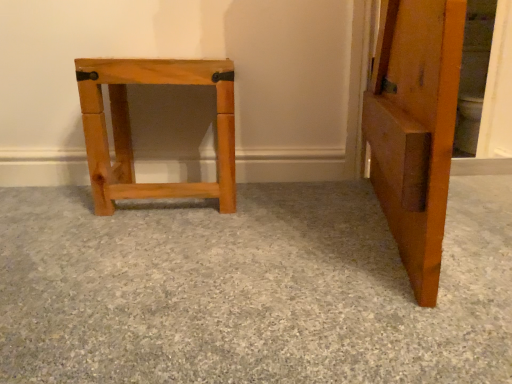
What do you see at coordinates (250, 289) in the screenshot? I see `natural wood stool at left` at bounding box center [250, 289].

The height and width of the screenshot is (384, 512). Find the location of `natural wood stool at left`. natural wood stool at left is located at coordinates (250, 289).

In order to face natural wood stool at left, should I rotate leftwards or rightwards?

You should look right and rotate roughly 3.072 degrees.

In order to click on natural wood stool at center in this screenshot , I will do `click(130, 128)`.

Describe the element at coordinates (130, 128) in the screenshot. I see `natural wood stool at center` at that location.

Identify the location of natural wood stool at left. (250, 289).

Which object is positioned more to the right, natural wood stool at center or natural wood stool at left?

natural wood stool at left.

Looking at this image, considering the positions of objects natural wood stool at center and natural wood stool at left in the image provided, who is in front, natural wood stool at center or natural wood stool at left?

natural wood stool at left is more forward.

Considering the points (116, 179) and (409, 297), which point is in front, point (116, 179) or point (409, 297)?

The point (409, 297) is closer to the camera.

From the image's perspective, is natural wood stool at center above or below natural wood stool at left?

Based on their image positions, natural wood stool at center is located above natural wood stool at left.

From the picture: From a real-world perspective, which object stands above the other?

From a 3D spatial view, natural wood stool at center is above.

Is natural wood stool at center thinner than natural wood stool at left?

Yes, natural wood stool at center is thinner than natural wood stool at left.

Who is taller, natural wood stool at center or natural wood stool at left?

natural wood stool at center.

Which of these two, natural wood stool at center or natural wood stool at left, is smaller?

Smaller between the two is natural wood stool at center.

Choose the correct answer: Is natural wood stool at center inside natural wood stool at left or outside it?

natural wood stool at center is spatially situated outside natural wood stool at left.

Does natural wood stool at center touch natural wood stool at left?

No, natural wood stool at center is not touching natural wood stool at left.

Is natural wood stool at center facing towards natural wood stool at left?

Yes, natural wood stool at center is turned towards natural wood stool at left.

Where is `concrete that is in front of the natural wood stool at center`? The height and width of the screenshot is (384, 512). concrete that is in front of the natural wood stool at center is located at coordinates (250, 289).

Consider the image. Between natural wood stool at left and natural wood stool at center, which one appears on the right side from the viewer's perspective?

natural wood stool at left.

Does natural wood stool at left lie behind natural wood stool at center?

No, natural wood stool at left is in front of natural wood stool at center.

Does point (128, 341) appear closer or farther from the camera than point (95, 113)?

Point (128, 341) is closer to the camera than point (95, 113).

From the image's perspective, is natural wood stool at left above or below natural wood stool at center?

Based on their image positions, natural wood stool at left is located beneath natural wood stool at center.

From a real-world perspective, is natural wood stool at left positioned under natural wood stool at center based on gravity?

Yes.

Looking at this image, can you confirm if natural wood stool at left is thinner than natural wood stool at center?

No.

Based on the photo, considering the sizes of natural wood stool at left and natural wood stool at center in the image, is natural wood stool at left taller or shorter than natural wood stool at center?

natural wood stool at left is shorter than natural wood stool at center.

Between natural wood stool at left and natural wood stool at center, which one has larger size?

A: Bigger between the two is natural wood stool at left.

Choose the correct answer: Is natural wood stool at left inside natural wood stool at center or outside it?

natural wood stool at left exists outside the volume of natural wood stool at center.

Is natural wood stool at left in contact with natural wood stool at center?

No, natural wood stool at left is not next to natural wood stool at center.

Is natural wood stool at left positioned with its back to natural wood stool at center?

natural wood stool at left is not turned away from natural wood stool at center.

Locate an element on the screen. concrete in front of the natural wood stool at center is located at coordinates (250, 289).

The width and height of the screenshot is (512, 384). Identify the location of concrete that is below the natural wood stool at center (from the image's perspective). (250, 289).

Locate an element on the screen. This screenshot has width=512, height=384. furniture that appears above the natural wood stool at left (from the image's perspective) is located at coordinates point(130,128).